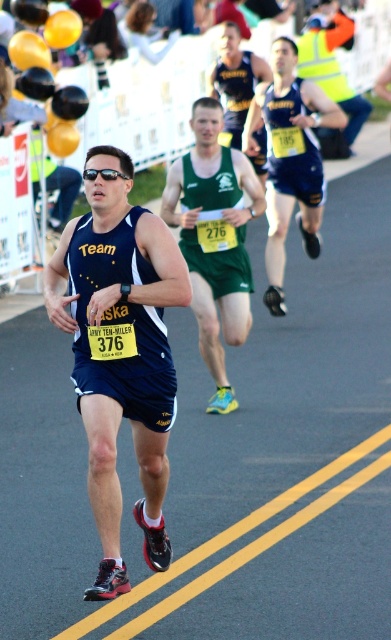
You are a runner in the Army Ten Miler race. You notice two items in your view ahead of you. One is the matte blue singlet at center and the other is the yellow reflective vest at upper right. Which of these two items is located more to the left in your field of view?

The matte blue singlet at center is positioned on the left side of the yellow reflective vest at upper right, so the matte blue singlet at center is more to the left in your field of view.

You are a photographer positioned at the starting line of the Army Ten Miler race. You want to capture a closeup of the matte blue singlet at center without moving your position. Considering your camera has a maximum zoom range of 15 feet, can you achieve this?

The matte blue singlet at center is 18.62 feet away from the camera. Since the maximum zoom range is 15 feet, the photographer cannot capture a closeup of the matte blue singlet at center without moving closer.

You are a photographer at the Army Ten Miler race. You want to take a photo of the runner in the matte blue singlet at center and the runner in the green fabric running suit at center. Based on their heights, which runner should you position closer to the camera to ensure both appear equally tall in the photo?

The matte blue singlet at center is not as tall as the green fabric running suit at center. To make them appear equally tall in the photo, position the matte blue singlet at center closer to the camera since it is shorter. This adjustment will compensate for the height difference, ensuring both runners look the same height in the photo.